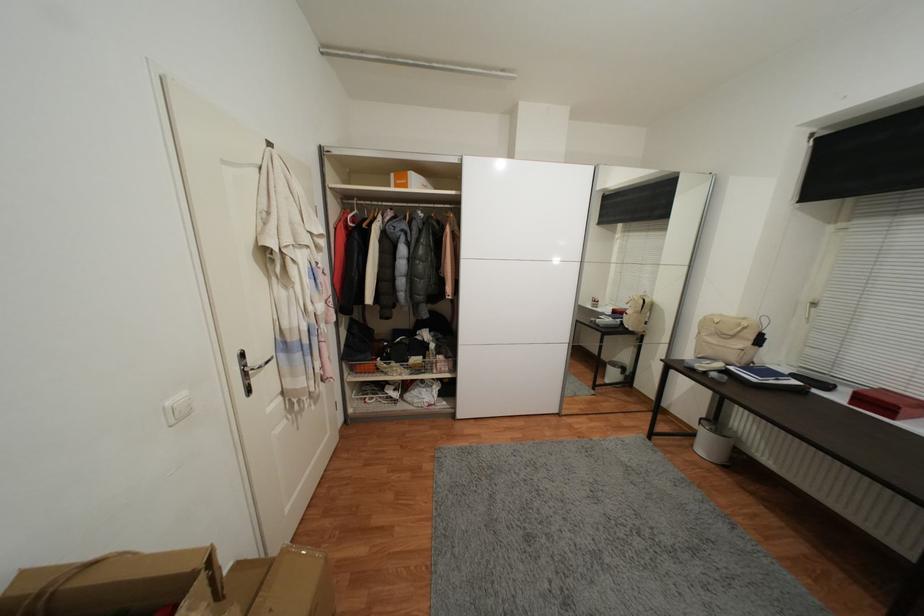
Find the location of a particular element. The image size is (924, 616). wire basket is located at coordinates (375, 395).